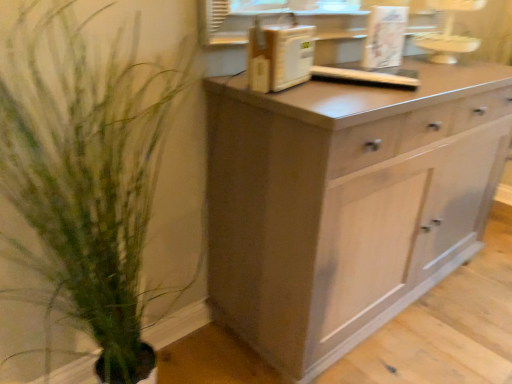
Question: In terms of height, does white plastic microwave at upper center look taller or shorter compared to green leafy plant at left?

Choices:
 (A) short
 (B) tall

Answer: (A)

Question: In the image, is white plastic microwave at upper center positioned in front of or behind green leafy plant at left?

Choices:
 (A) front
 (B) behind

Answer: (B)

Question: Estimate the real-world distances between objects in this image. Which object is farther from the green leafy plant at left?

Choices:
 (A) matte gray cabinet at center
 (B) white plastic microwave at upper center

Answer: (B)

Question: Estimate the real-world distances between objects in this image. Which object is farther from the matte gray cabinet at center?

Choices:
 (A) white plastic microwave at upper center
 (B) green leafy plant at left

Answer: (B)